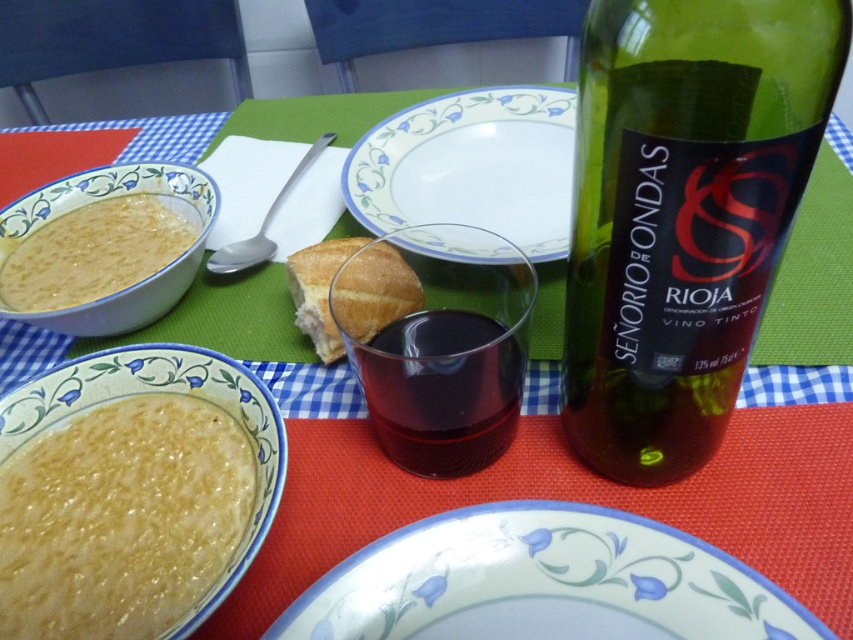
Question: Which object is closer to the camera taking this photo?

Choices:
 (A) white glossy bowl at left
 (B) golden brown crusty bread at center

Answer: (B)

Question: Is white floral plate at lower center below yellow matte porridge at lower left?

Choices:
 (A) yes
 (B) no

Answer: (A)

Question: Is green glass bottle at upper right below golden brown crusty bread at center?

Choices:
 (A) no
 (B) yes

Answer: (B)

Question: Is yellow matte porridge at lower left thinner than golden brown crusty bread at center?

Choices:
 (A) yes
 (B) no

Answer: (B)

Question: Which point is closer to the camera?

Choices:
 (A) (157, 172)
 (B) (611, 8)
 (C) (148, 602)

Answer: (B)

Question: Which point is farther to the camera?

Choices:
 (A) white porcelain plate at center
 (B) yellow matte porridge at lower left
 (C) dark red glass at center

Answer: (A)